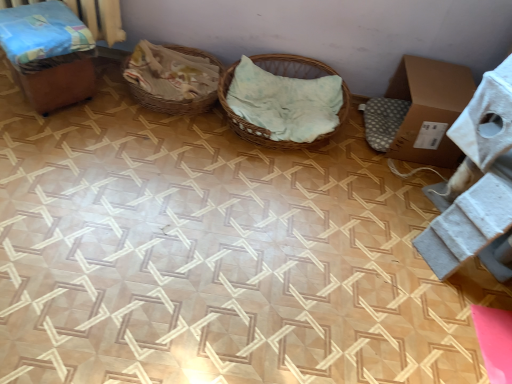
Locate an element on the screen. Image resolution: width=512 pixels, height=384 pixels. empty space that is ontop of brown cardboard box at right (from a real-world perspective) is located at coordinates (437, 77).